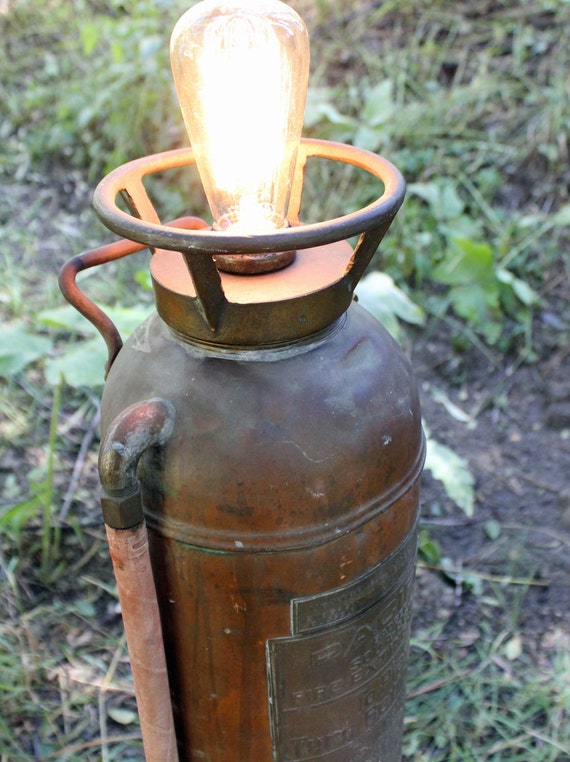
Identify the location of paint mark. The height and width of the screenshot is (762, 570). (229, 632).